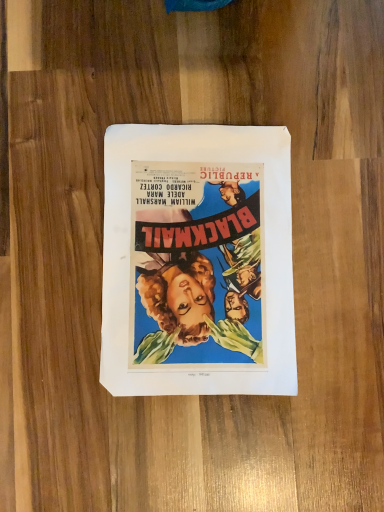
The width and height of the screenshot is (384, 512). What are the coordinates of `vibrant paper poster at center` in the screenshot? It's located at (197, 261).

What do you see at coordinates (197, 261) in the screenshot? This screenshot has height=512, width=384. I see `vibrant paper poster at center` at bounding box center [197, 261].

Where is `vibrant paper poster at center`? This screenshot has height=512, width=384. vibrant paper poster at center is located at coordinates (197, 261).